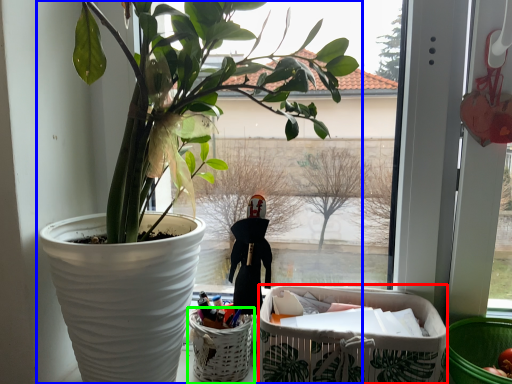
Question: Which is farther away from shopping basket (highlighted by a red box)? houseplant (highlighted by a blue box) or basket (highlighted by a green box)?

Choices:
 (A) houseplant
 (B) basket

Answer: (A)